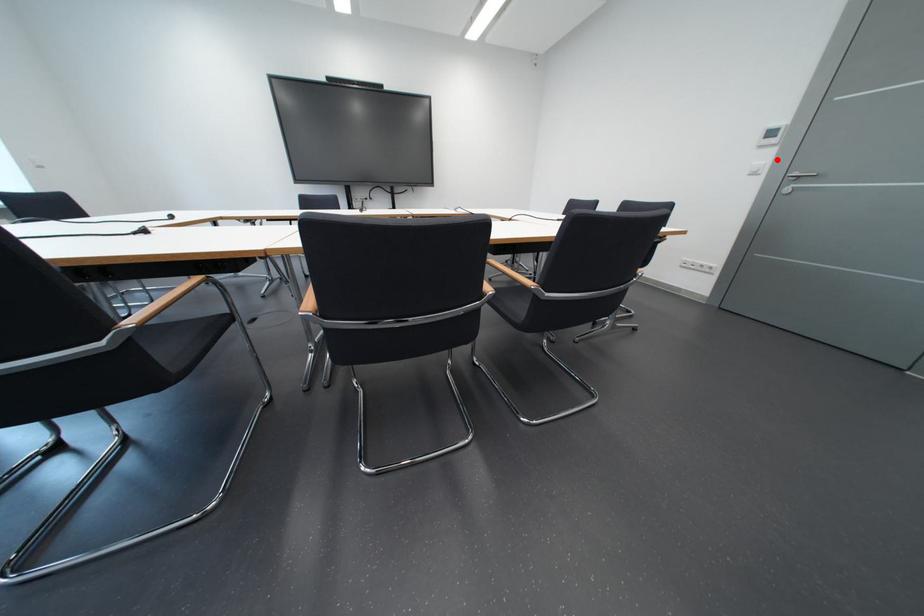
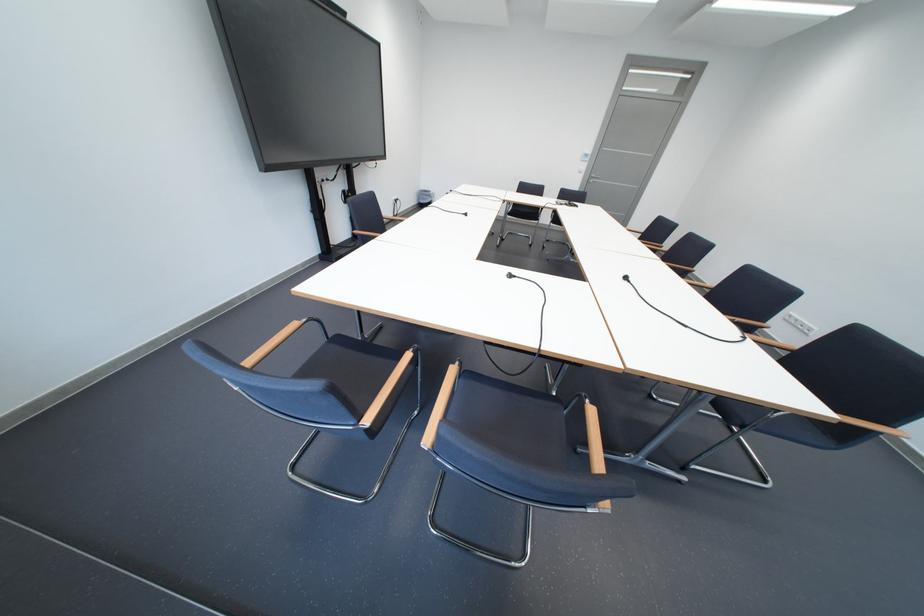
Locate, in the second image, the point that corresponds to the highlighted location in the first image.

(596, 168)